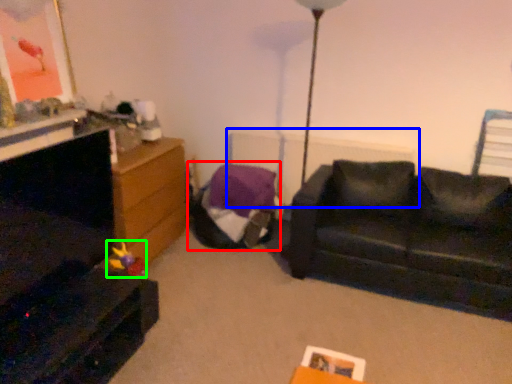
Question: Which is nearer to the bean bag chair (highlighted by a red box)? radiator (highlighted by a blue box) or toy (highlighted by a green box).

Choices:
 (A) radiator
 (B) toy

Answer: (A)